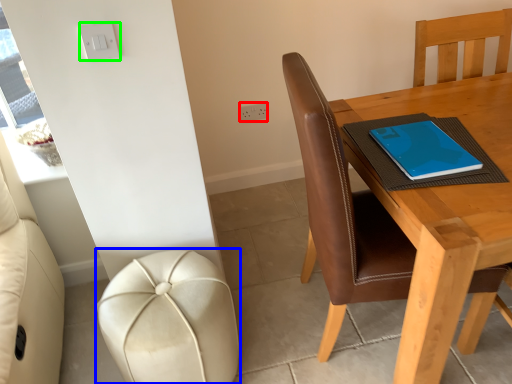
Question: Which object is positioned closest to electric outlet (highlighted by a red box)? Select from stool (highlighted by a blue box) and light switch (highlighted by a green box).

Choices:
 (A) stool
 (B) light switch

Answer: (B)